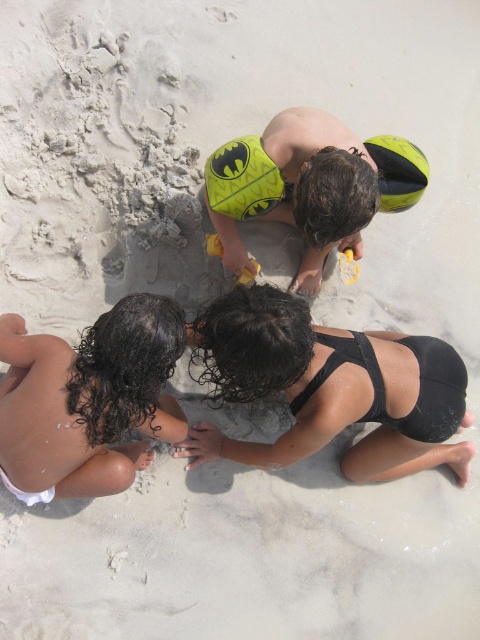
Is yellow rubber ball at center positioned at the back of yellow rubber duck at center?

No, yellow rubber ball at center is closer to the viewer.

Is yellow rubber ball at center shorter than yellow rubber duck at center?

No, yellow rubber ball at center is not shorter than yellow rubber duck at center.

Between point (235, 177) and point (355, 268), which one is positioned behind?

The point (355, 268) is more distant.

The height and width of the screenshot is (640, 480). Identify the location of yellow rubber ball at center. (242, 179).

Is yellow rubber ball at upper center above yellow rubber duck at center?

Indeed, yellow rubber ball at upper center is positioned over yellow rubber duck at center.

Based on the photo, is yellow rubber ball at upper center to the left of yellow rubber duck at center from the viewer's perspective?

In fact, yellow rubber ball at upper center is to the right of yellow rubber duck at center.

Measure the distance between point (395,150) and camera.

The distance of point (395,150) from camera is 8.16 feet.

The height and width of the screenshot is (640, 480). What are the coordinates of `yellow rubber ball at upper center` in the screenshot? It's located at (397, 172).

Who is positioned more to the right, yellow rubber ball at center or yellow plastic shovel at center?

From the viewer's perspective, yellow rubber ball at center appears more on the right side.

Between point (242, 208) and point (217, 240), which one is positioned behind?

The point (217, 240) is more distant.

This screenshot has height=640, width=480. What are the coordinates of `yellow rubber ball at center` in the screenshot? It's located at (242, 179).